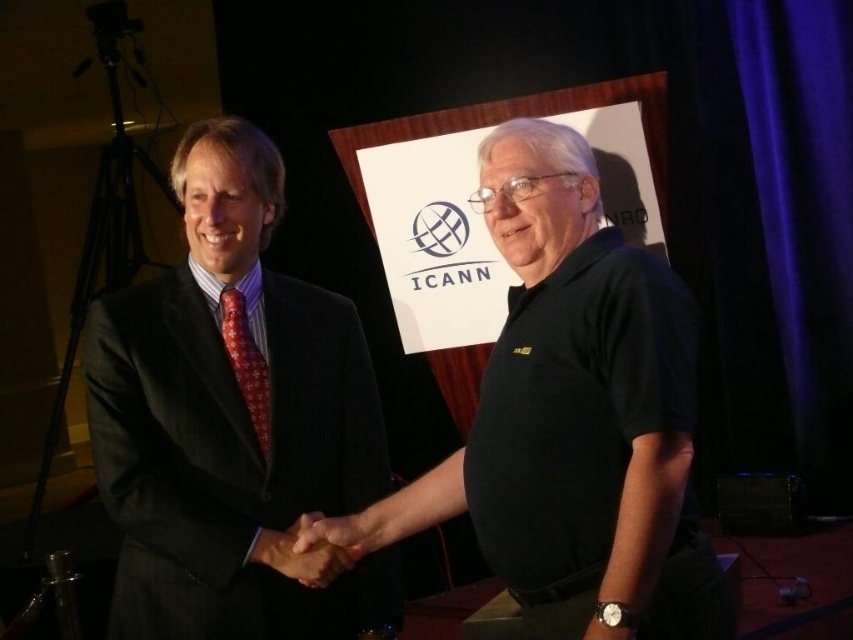
Between red floral tie at center and matte black hand at center, which one is positioned higher?

red floral tie at center

The width and height of the screenshot is (853, 640). What are the coordinates of `red floral tie at center` in the screenshot? It's located at 247,364.

What do you see at coordinates (247, 364) in the screenshot? I see `red floral tie at center` at bounding box center [247, 364].

What are the coordinates of `red floral tie at center` in the screenshot? It's located at (247, 364).

How far apart are smooth skin handshake at center and matte black hand at center?

smooth skin handshake at center is 1.01 inches from matte black hand at center.

Between point (260, 547) and point (306, 545), which one is positioned in front?

Point (306, 545) is in front.

Find the location of a particular element. This screenshot has height=640, width=853. smooth skin handshake at center is located at coordinates (302, 554).

Is red floral tie at center above smooth skin handshake at center?

Correct, red floral tie at center is located above smooth skin handshake at center.

Is red floral tie at center thinner than smooth skin handshake at center?

Correct, red floral tie at center's width is less than smooth skin handshake at center's.

Which is in front, point (252, 412) or point (308, 525)?

Positioned in front is point (308, 525).

This screenshot has height=640, width=853. Find the location of `red floral tie at center`. red floral tie at center is located at coordinates [247, 364].